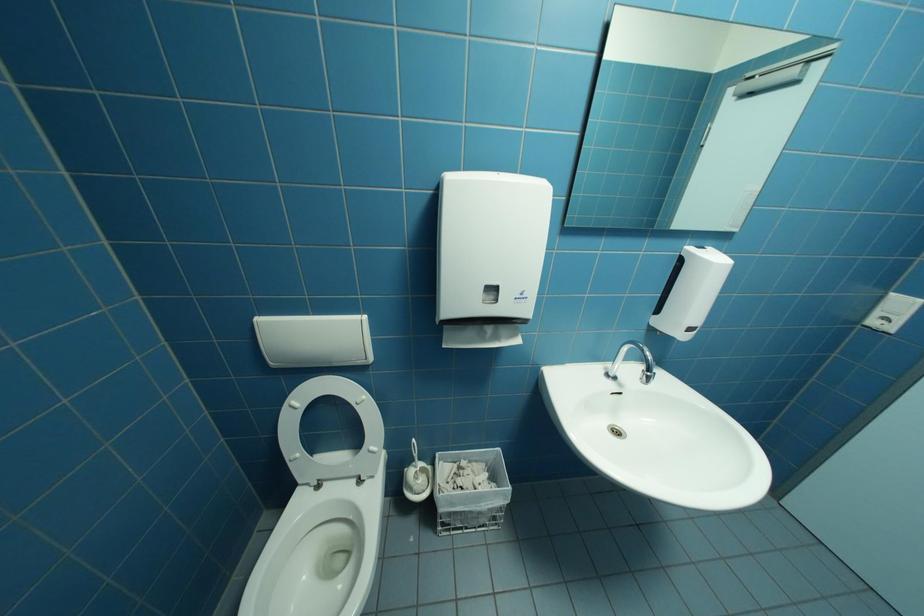
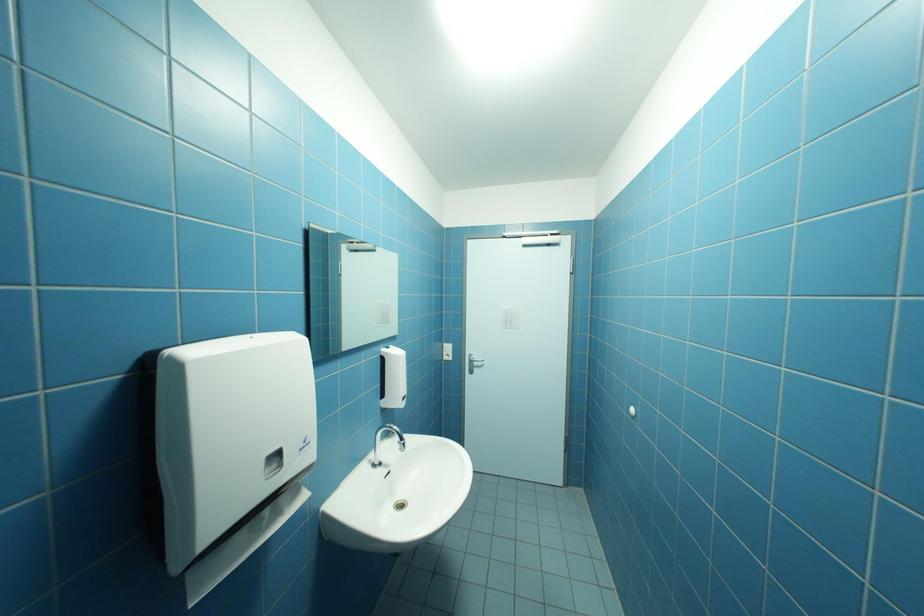
Question: The camera is either moving clockwise (left) or counter-clockwise (right) around the object. The first image is from the beginning of the video and the second image is from the end. Is the camera moving left or right when shooting the video?

Choices:
 (A) Left
 (B) Right

Answer: (A)